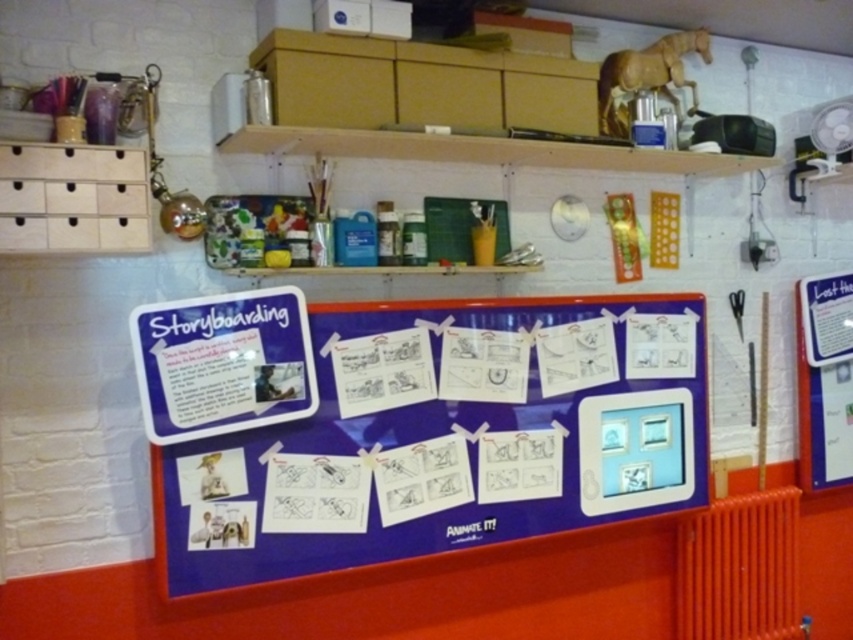
You are an animator standing in front of the workspace. You need to place a new storyboard panel between the blue fabric storyboard at center and the orange metallic radiator at lower right. Which object should you place it closer to if you want it to be in the foreground?

The blue fabric storyboard at center is closer to the viewer than the orange metallic radiator at lower right. To place the new storyboard panel in the foreground, you should position it closer to the blue fabric storyboard at center.

You are an animator who needs to place a new storyboard panel on the blue fabric storyboard at center. To ensure it doesn not block the orange metallic radiator at lower right, which direction should you place it?

The blue fabric storyboard at center is to the left of the orange metallic radiator at lower right, so placing the new storyboard panel to the right side of the blue fabric storyboard at center would keep it away from the radiator.